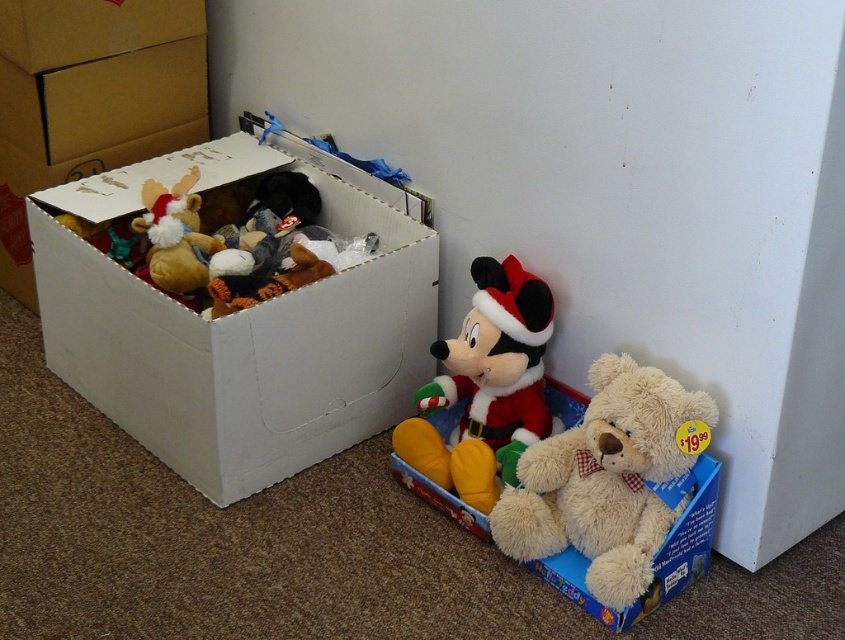
Can you confirm if white cardboard box at upper left is taller than fluffy beige teddy bear at lower right?

Yes.

Is point (102, 115) closer to camera compared to point (657, 428)?

No, it is not.

Where is `white cardboard box at upper left`? white cardboard box at upper left is located at coordinates (90, 99).

Is white cardboard box at upper left wider than velvet santa mickey mouse at center?

Correct, the width of white cardboard box at upper left exceeds that of velvet santa mickey mouse at center.

Is white cardboard box at upper left taller than velvet santa mickey mouse at center?

Yes.

What do you see at coordinates (90, 99) in the screenshot? I see `white cardboard box at upper left` at bounding box center [90, 99].

Identify the location of white cardboard box at upper left. Image resolution: width=845 pixels, height=640 pixels. (90, 99).

How much distance is there between white cardboard box at left and velvet santa mickey mouse at center?

They are 12.94 inches apart.

Measure the distance between point (330, 401) and camera.

Result: Point (330, 401) and camera are 1.70 meters apart from each other.

I want to click on white cardboard box at left, so click(238, 326).